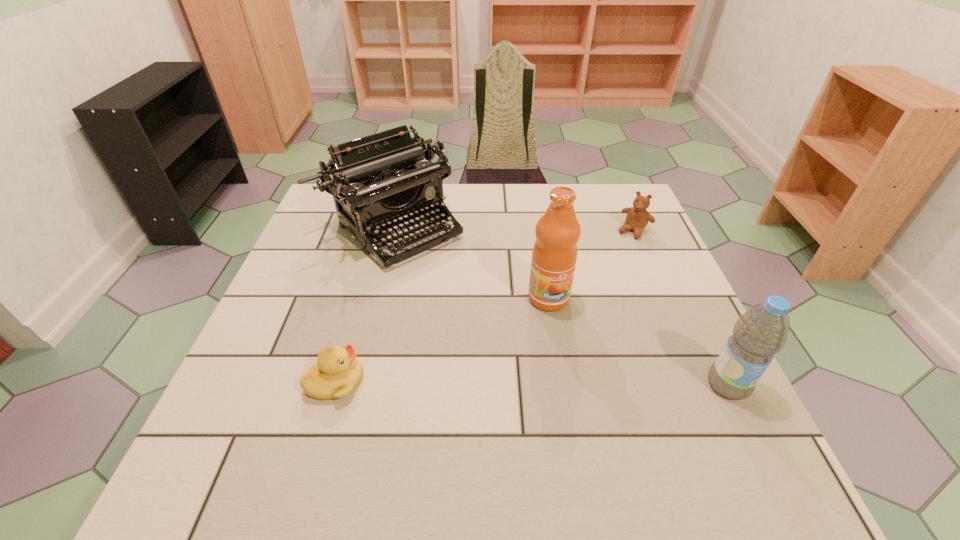
The image size is (960, 540). I want to click on water bottle that is at the near edge, so click(761, 332).

At what (x,y) coordinates should I click in order to perform the action: click on duckling at the left edge. Please return your answer as a coordinate pair (x, y). Looking at the image, I should click on (337, 372).

Where is `typewriter that is positioned at the left edge`? This screenshot has width=960, height=540. typewriter that is positioned at the left edge is located at coordinates (383, 181).

You are a GUI agent. You are given a task and a screenshot of the screen. Output one action in this format:
    pyautogui.click(x=<x>, y=<y>)
    Task: Click on the water bottle located in the right edge section of the desktop
    The image size is (960, 540).
    Given the screenshot: What is the action you would take?
    pyautogui.click(x=761, y=332)

This screenshot has width=960, height=540. Identify the location of teddy bear present at the right edge. (637, 218).

Where is `object that is positioned at the far left corner`? object that is positioned at the far left corner is located at coordinates (383, 181).

What are the coordinates of `object situated at the near left corner` in the screenshot? It's located at (337, 372).

This screenshot has height=540, width=960. What are the coordinates of `object present at the far right corner` in the screenshot? It's located at (637, 218).

This screenshot has height=540, width=960. Find the location of `object that is at the near right corner`. object that is at the near right corner is located at coordinates (761, 332).

In the image, there is a desktop. In order to click on vacant space at the far edge in this screenshot , I will do [x=465, y=195].